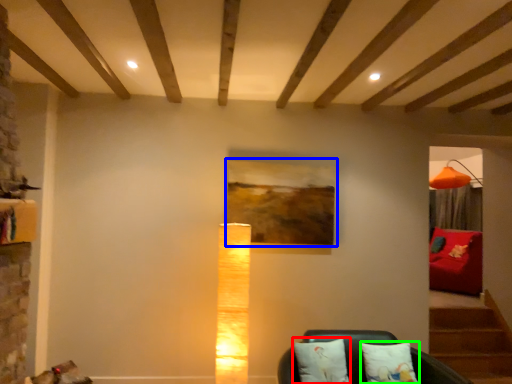
Question: Based on their relative distances, which object is nearer to pillow (highlighted by a red box)? Choose from picture frame (highlighted by a blue box) and pillow (highlighted by a green box).

Choices:
 (A) picture frame
 (B) pillow

Answer: (B)